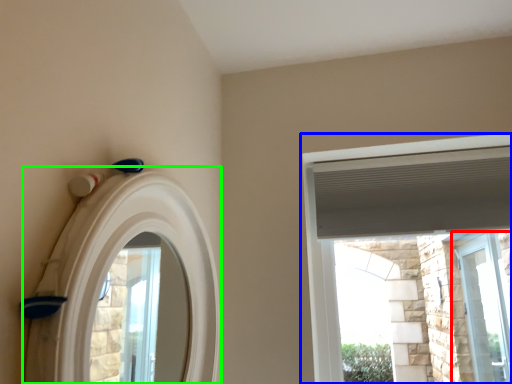
Question: Based on their relative distances, which object is farther from window (highlighted by a red box)? Choose from window (highlighted by a blue box) and archway (highlighted by a green box).

Choices:
 (A) window
 (B) archway

Answer: (B)